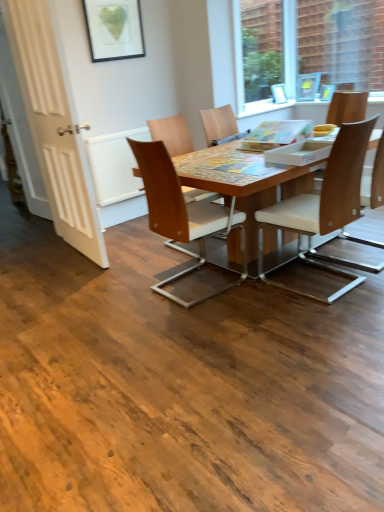
This screenshot has width=384, height=512. In order to click on free spot to the left of white wooden door at left in this screenshot , I will do `click(40, 258)`.